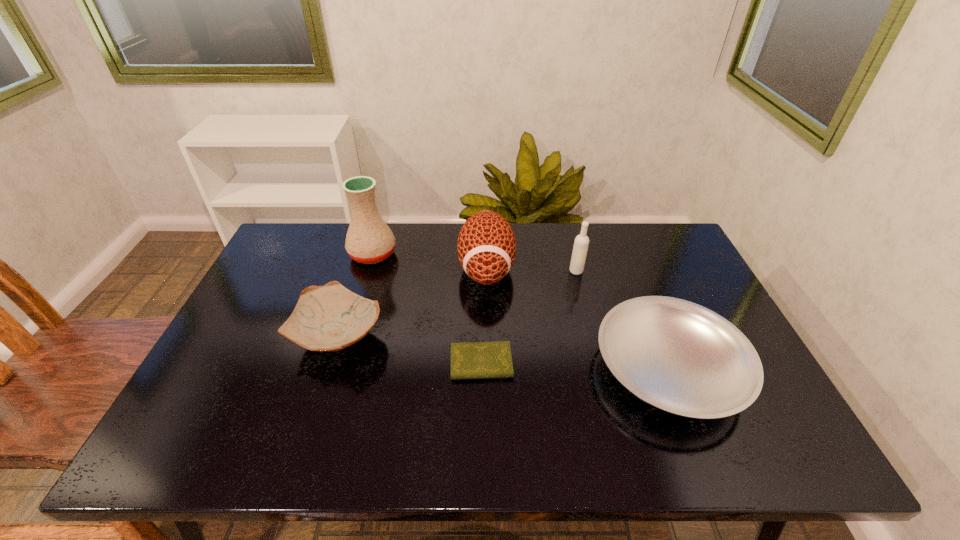
Locate an element on the screen. The height and width of the screenshot is (540, 960). the tallest object is located at coordinates (369, 240).

At what (x,y) coordinates should I click in order to perform the action: click on the farther pottery. Please return your answer as a coordinate pair (x, y). The height and width of the screenshot is (540, 960). Looking at the image, I should click on (369, 240).

Find the location of a particular element. This screenshot has width=960, height=540. vodka is located at coordinates (581, 243).

At what (x,y) coordinates should I click in order to perform the action: click on football. Please return your answer as a coordinate pair (x, y). Looking at the image, I should click on (486, 246).

Where is `the third shortest object`? The image size is (960, 540). the third shortest object is located at coordinates (330, 318).

Where is `the nearer pottery`? Image resolution: width=960 pixels, height=540 pixels. the nearer pottery is located at coordinates pyautogui.click(x=330, y=318).

Find the location of `bedpan`. bedpan is located at coordinates tap(678, 356).

Locate an element on the screen. This screenshot has width=960, height=540. the shortest object is located at coordinates (470, 360).

Locate an element on the screen. vacant area situated on the left of the taller pottery is located at coordinates (272, 254).

This screenshot has height=540, width=960. Identify the location of free space located 0.400m on the left of the vodka. (442, 271).